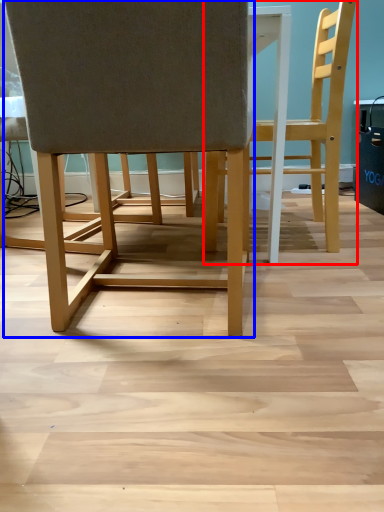
Question: Among these objects, which one is nearest to the camera, chair (highlighted by a red box) or chair (highlighted by a blue box)?

Choices:
 (A) chair
 (B) chair

Answer: (B)